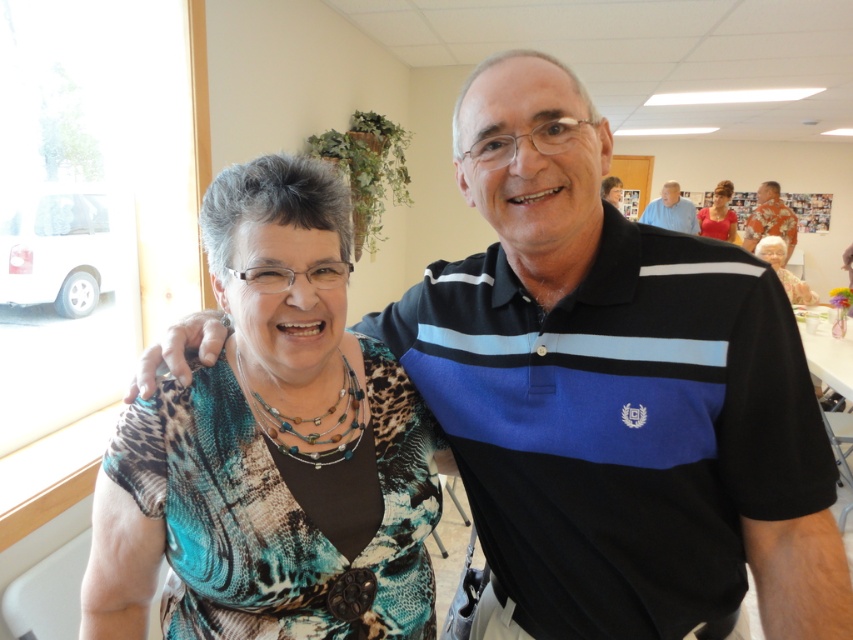
Is black striped polo shirt at center positioned behind matte red blouse at upper right?

That is False.

Can you confirm if black striped polo shirt at center is smaller than matte red blouse at upper right?

Yes.

Which is behind, point (631, 579) or point (701, 224)?

Point (701, 224)

Identify the location of black striped polo shirt at center. (618, 426).

Between hawaiian shirt at upper right and matte red blouse at upper right, which one has more height?

Standing taller between the two is hawaiian shirt at upper right.

Can you confirm if hawaiian shirt at upper right is thinner than matte red blouse at upper right?

No.

Between point (782, 208) and point (708, 218), which one is positioned in front?

Point (782, 208)

Locate an element on the screen. The image size is (853, 640). hawaiian shirt at upper right is located at coordinates (770, 218).

Does matte red blouse at upper right appear on the left side of blue striped polo shirt at upper center?

Incorrect, matte red blouse at upper right is not on the left side of blue striped polo shirt at upper center.

Does matte red blouse at upper right lie in front of blue striped polo shirt at upper center?

No, matte red blouse at upper right is further to the viewer.

I want to click on matte red blouse at upper right, so click(718, 214).